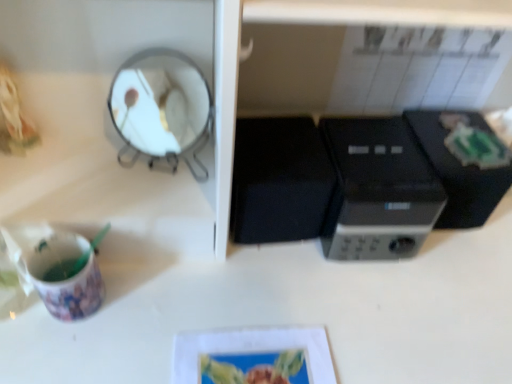
Question: Is matte plastic cup at lower left wider or thinner than black plastic microwave at center?

Choices:
 (A) thin
 (B) wide

Answer: (A)

Question: From the image's perspective, is matte plastic cup at lower left positioned above or below black plastic microwave at center?

Choices:
 (A) below
 (B) above

Answer: (A)

Question: Considering the real-world distances, which object is closest to the black plastic microwave at center?

Choices:
 (A) metallic silver mirror at upper left
 (B) black plastic microwave at center, which is the first appliance in right-to-left order
 (C) black matte microwave at center, which appears as the first appliance when viewed from the left
 (D) matte plastic cup at lower left

Answer: (B)

Question: Considering the real-world distances, which object is closest to the matte plastic cup at lower left?

Choices:
 (A) black matte microwave at center, acting as the second appliance starting from the right
 (B) black plastic microwave at center
 (C) metallic silver mirror at upper left
 (D) black plastic microwave at center, which is the first appliance in right-to-left order

Answer: (C)